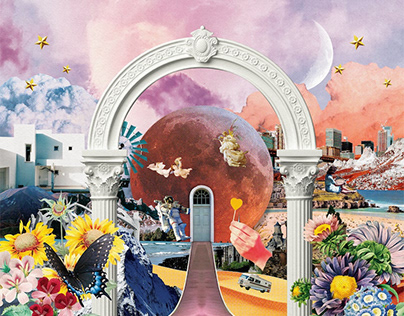
Find the location of a particular element. The width and height of the screenshot is (404, 316). white pillars is located at coordinates (102, 206), (298, 211).